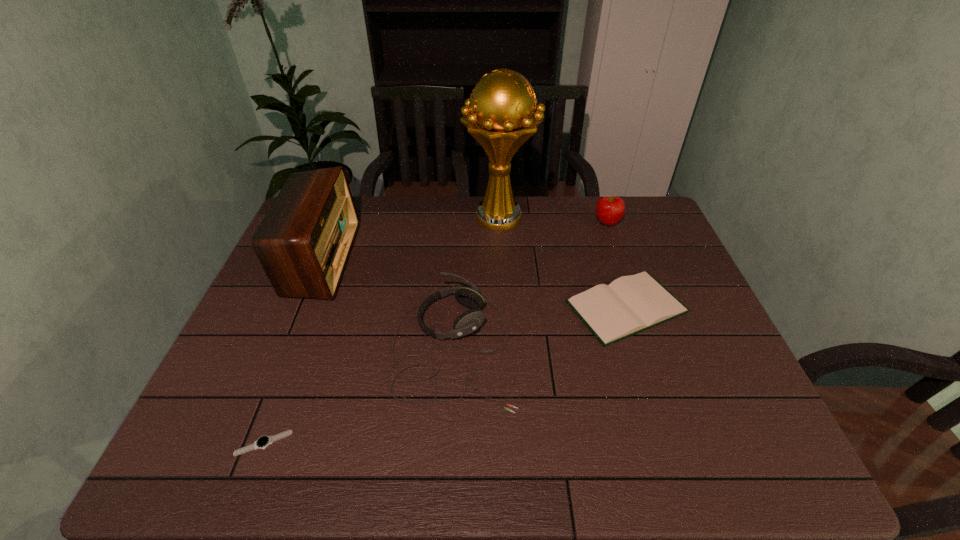
Where is `vacant area located on the outer surface of the headset`? This screenshot has height=540, width=960. vacant area located on the outer surface of the headset is located at coordinates (582, 347).

This screenshot has height=540, width=960. Identify the location of vacant position located on the back of the fifth tallest object. (591, 199).

Find the location of `vacant space located on the back of the shortest object`. vacant space located on the back of the shortest object is located at coordinates (300, 345).

Locate an element on the screen. The image size is (960, 540). trophy_cup located in the far edge section of the desktop is located at coordinates (499, 115).

This screenshot has width=960, height=540. In order to click on radio receiver situated at the far edge in this screenshot , I will do `click(303, 243)`.

Locate an element on the screen. Image resolution: width=960 pixels, height=540 pixels. apple that is at the far edge is located at coordinates (609, 210).

At what (x,y) coordinates should I click in order to perform the action: click on object situated at the near edge. Please return your answer as a coordinate pair (x, y). The image size is (960, 540). Looking at the image, I should click on (263, 442).

Locate an element on the screen. The image size is (960, 540). radio receiver present at the left edge is located at coordinates (303, 243).

What are the coordinates of `watch located at the left edge` in the screenshot? It's located at (263, 442).

The height and width of the screenshot is (540, 960). Find the location of `apple present at the right edge`. apple present at the right edge is located at coordinates pos(609,210).